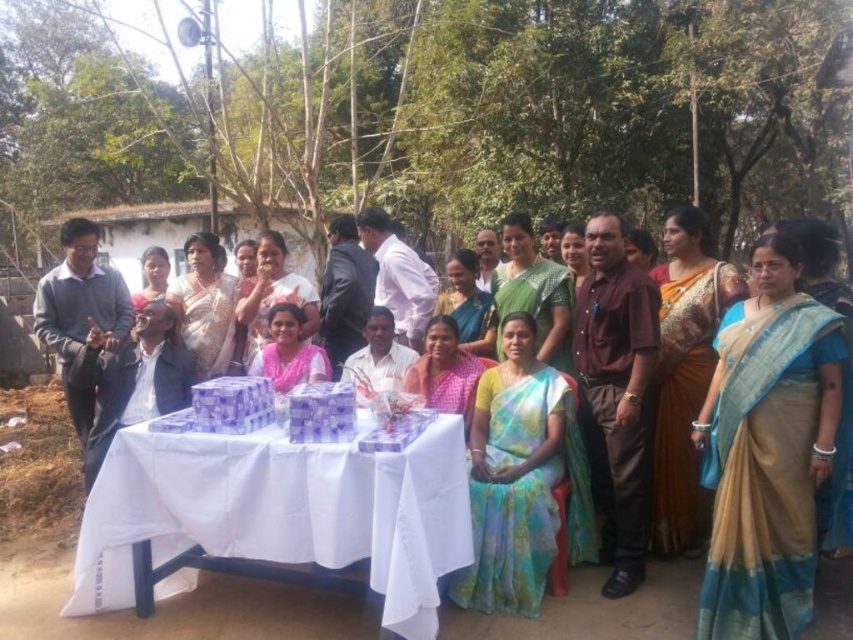
You are at the point labeled point (241, 493) and want to walk to the point labeled point (473, 284) in the image. Which direction should you move relative to the other point?

You should move backward because point (241, 493) is in front of point (473, 284).

You are taking a photo of the group and want to focus on the person at point (450, 515) and the person at point (137, 307). Which of these two people is closer to the camera?

The person at point (450, 515) is closer to the camera than the person at point (137, 307).